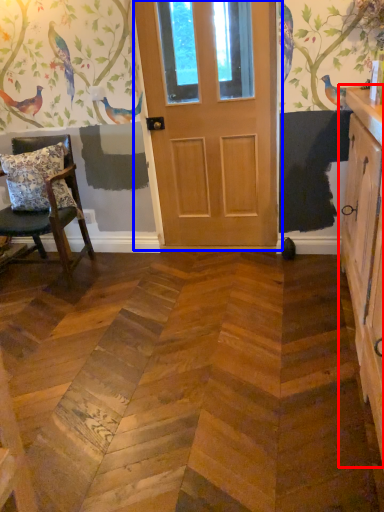
Question: Among these objects, which one is nearest to the camera, cabinetry (highlighted by a red box) or door (highlighted by a blue box)?

Choices:
 (A) cabinetry
 (B) door

Answer: (A)